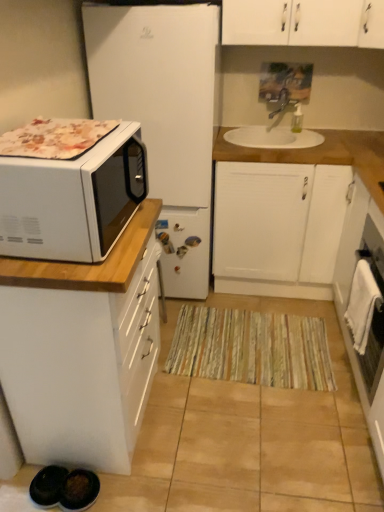
Question: From their relative heights in the image, would you say white glossy oven at right is taller or shorter than white glossy microwave at left, which is the second cabinetry in right-to-left order?

Choices:
 (A) short
 (B) tall

Answer: (A)

Question: Would you say white glossy oven at right is inside or outside white glossy microwave at left, positioned as the 1th cabinetry in left-to-right order?

Choices:
 (A) inside
 (B) outside

Answer: (B)

Question: Which of these objects is positioned farthest from the white glossy microwave at left?

Choices:
 (A) white glossy oven at right
 (B) striped fabric doormat at center
 (C) white ceramic sink at upper center
 (D) white matte cabinet at center, the second cabinetry viewed from the left
 (E) white matte refrigerator at left

Answer: (C)

Question: Based on their relative distances, which object is nearer to the white ceramic sink at upper center?

Choices:
 (A) white glossy microwave at left
 (B) striped fabric doormat at center
 (C) white glossy oven at right
 (D) white matte refrigerator at left
 (E) white matte cabinet at center, the second cabinetry viewed from the left

Answer: (E)